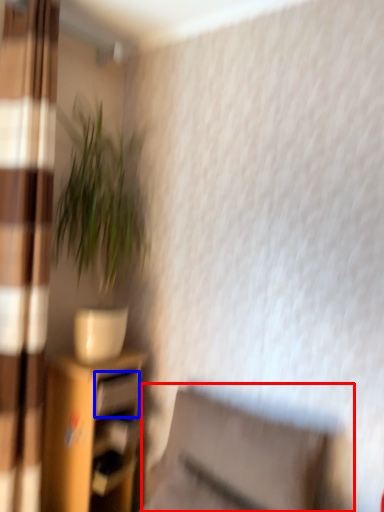
Question: Which object is closer to the camera taking this photo, swivel chair (highlighted by a red box) or drawer (highlighted by a blue box)?

Choices:
 (A) swivel chair
 (B) drawer

Answer: (A)